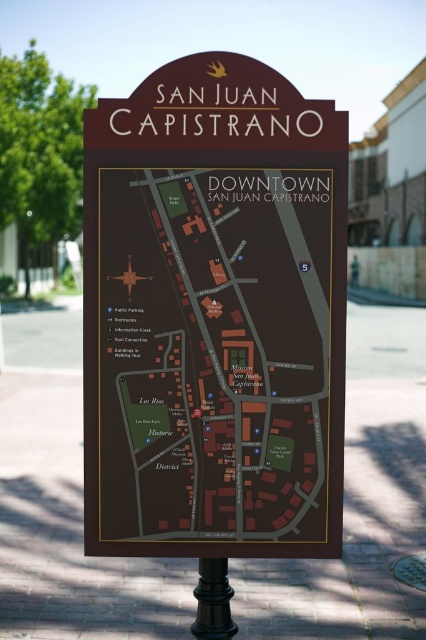
Question: Does dark brown paper map at center have a larger size compared to black polished pole at lower center?

Choices:
 (A) no
 (B) yes

Answer: (B)

Question: Is dark brown paper map at center smaller than black polished pole at lower center?

Choices:
 (A) yes
 (B) no

Answer: (B)

Question: Which point is farther to the camera?

Choices:
 (A) black polished pole at lower center
 (B) dark brown paper map at center

Answer: (A)

Question: Which object is closer to the camera taking this photo?

Choices:
 (A) dark brown paper map at center
 (B) black polished pole at lower center

Answer: (A)

Question: Is dark brown paper map at center below black polished pole at lower center?

Choices:
 (A) yes
 (B) no

Answer: (B)